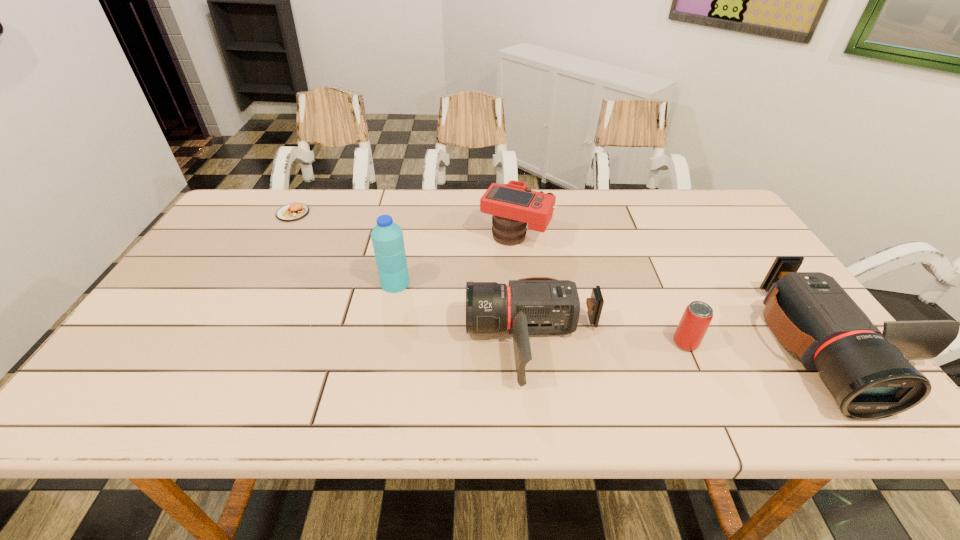
Where is `vacant space at the far edge of the desktop`? Image resolution: width=960 pixels, height=540 pixels. vacant space at the far edge of the desktop is located at coordinates (425, 200).

This screenshot has height=540, width=960. What are the coordinates of `vacant space at the left edge` in the screenshot? It's located at (200, 289).

This screenshot has height=540, width=960. What are the coordinates of `blank area at the far left corner` in the screenshot? It's located at (241, 207).

Where is `vacant area at the far right corner of the desktop`? The height and width of the screenshot is (540, 960). vacant area at the far right corner of the desktop is located at coordinates (704, 199).

The image size is (960, 540). Identify the location of empty space between the camera and the tallest object. (455, 260).

Where is `vacant area between the leftmost object and the camera`? The image size is (960, 540). vacant area between the leftmost object and the camera is located at coordinates (404, 225).

The height and width of the screenshot is (540, 960). Identify the location of empty space between the shortest object and the second object from right to left. (490, 278).

The image size is (960, 540). Find the location of `free spot between the left camcorder and the patty`. free spot between the left camcorder and the patty is located at coordinates (414, 278).

This screenshot has height=540, width=960. In order to click on free spot between the left camcorder and the second object from left to right in this screenshot , I will do `click(465, 313)`.

You are a GUI agent. You are given a task and a screenshot of the screen. Output one action in this format:
    pyautogui.click(x=<x>, y=<y>)
    Task: Click on the vacant area between the leftmost object and the beer can
    The height and width of the screenshot is (540, 960).
    Given the screenshot: What is the action you would take?
    pyautogui.click(x=490, y=278)